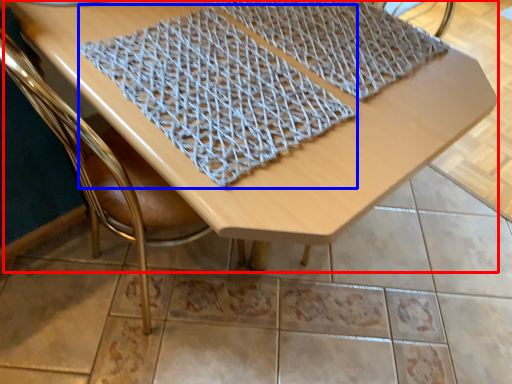
Question: Which object is further to the camera taking this photo, table (highlighted by a red box) or blanket (highlighted by a blue box)?

Choices:
 (A) table
 (B) blanket

Answer: (B)